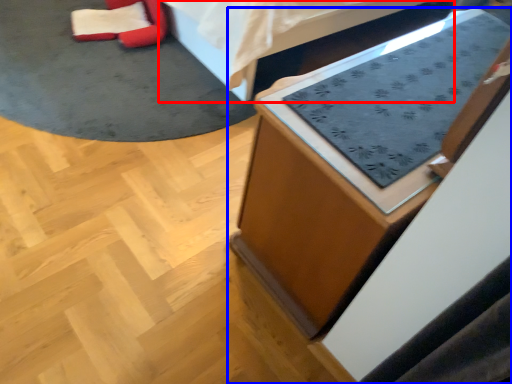
Question: Which object is further to the camera taking this photo, furniture (highlighted by a red box) or furniture (highlighted by a blue box)?

Choices:
 (A) furniture
 (B) furniture

Answer: (A)